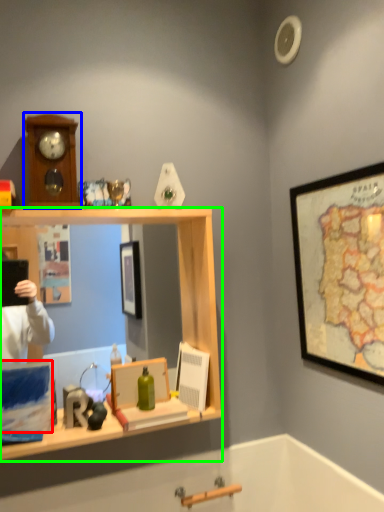
Question: Which object is the closest to the box (highlighted by a red box)? Choose among these: clock (highlighted by a blue box) or desk (highlighted by a green box).

Choices:
 (A) clock
 (B) desk

Answer: (B)